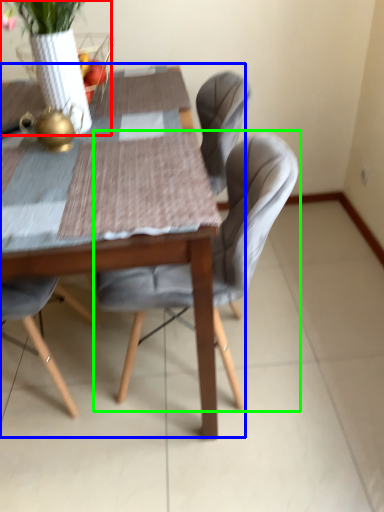
Question: Based on their relative distances, which object is farther from floral arrangement (highlighted by a red box)? Choose from kitchen & dining room table (highlighted by a blue box) and chair (highlighted by a green box).

Choices:
 (A) kitchen & dining room table
 (B) chair

Answer: (B)